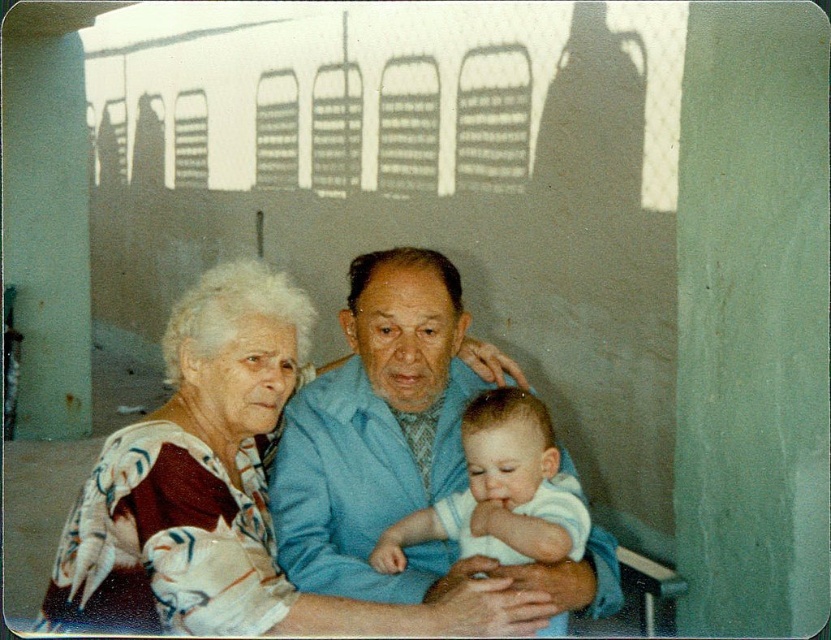
Question: Which is farther from the white soft fabric baby at center?

Choices:
 (A) blue fabric jacket at center
 (B) printed fabric shawl at center

Answer: (B)

Question: Which of the following is the farthest from the observer?

Choices:
 (A) white soft fabric baby at center
 (B) blue fabric jacket at center

Answer: (B)

Question: Is printed fabric shawl at center to the left of white soft fabric baby at center from the viewer's perspective?

Choices:
 (A) yes
 (B) no

Answer: (A)

Question: Among these objects, which one is farthest from the camera?

Choices:
 (A) white soft fabric baby at center
 (B) blue fabric jacket at center
 (C) printed fabric shawl at center

Answer: (B)

Question: Is printed fabric shawl at center positioned behind blue fabric jacket at center?

Choices:
 (A) no
 (B) yes

Answer: (A)

Question: Is printed fabric shawl at center further to the viewer compared to white soft fabric baby at center?

Choices:
 (A) no
 (B) yes

Answer: (A)